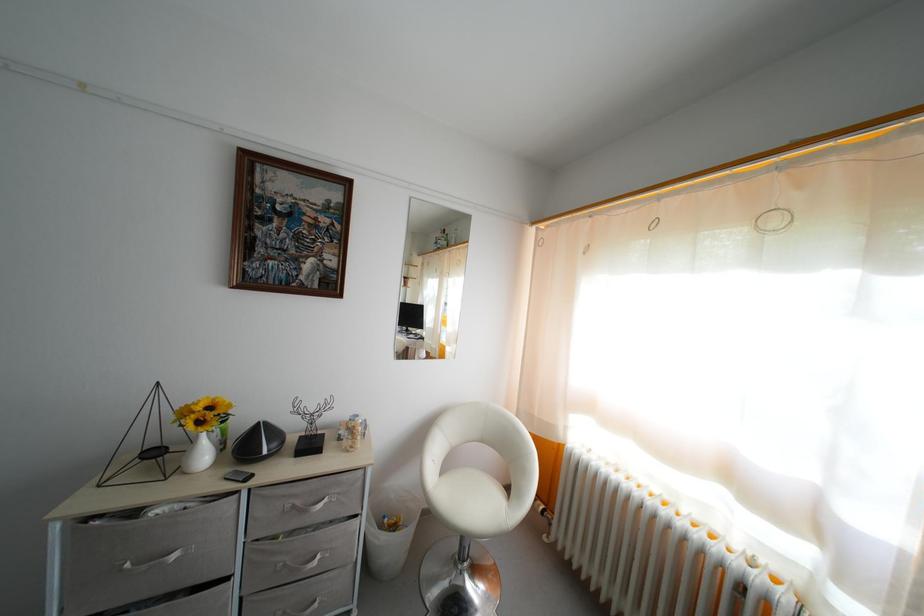
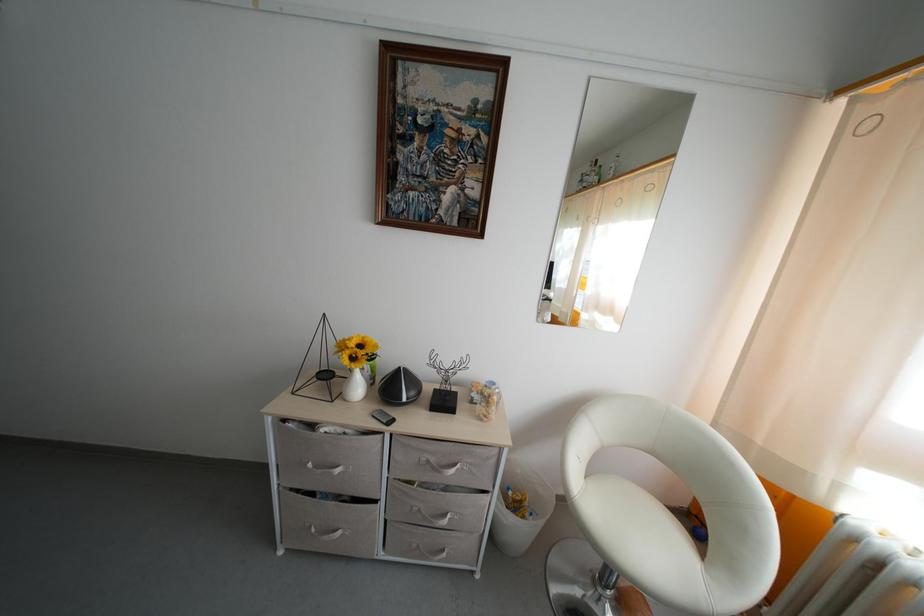
Question: Based on the continuous images, in which direction is the camera rotating? Reply with the corresponding letter.

Choices:
 (A) Left
 (B) Right
 (C) Up
 (D) Down

Answer: (A)